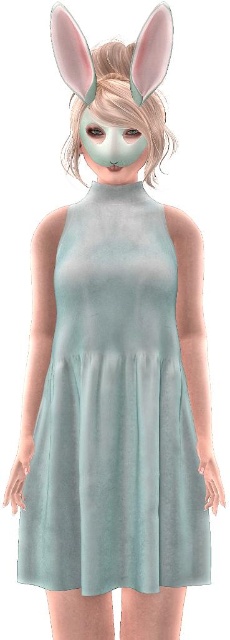
Question: Which point is farther to the camera?

Choices:
 (A) matte white mask at center
 (B) mint fabric dress at center

Answer: (A)

Question: Considering the relative positions of mint fabric dress at center and matte white mask at center in the image provided, where is mint fabric dress at center located with respect to matte white mask at center?

Choices:
 (A) below
 (B) above

Answer: (A)

Question: Is mint fabric dress at center wider than matte white mask at center?

Choices:
 (A) yes
 (B) no

Answer: (A)

Question: Does mint fabric dress at center lie in front of matte white mask at center?

Choices:
 (A) yes
 (B) no

Answer: (A)

Question: Which point is farther from the camera taking this photo?

Choices:
 (A) (115, 147)
 (B) (51, 451)

Answer: (B)

Question: Which of the following is the farthest from the observer?

Choices:
 (A) (152, 518)
 (B) (141, 134)

Answer: (B)